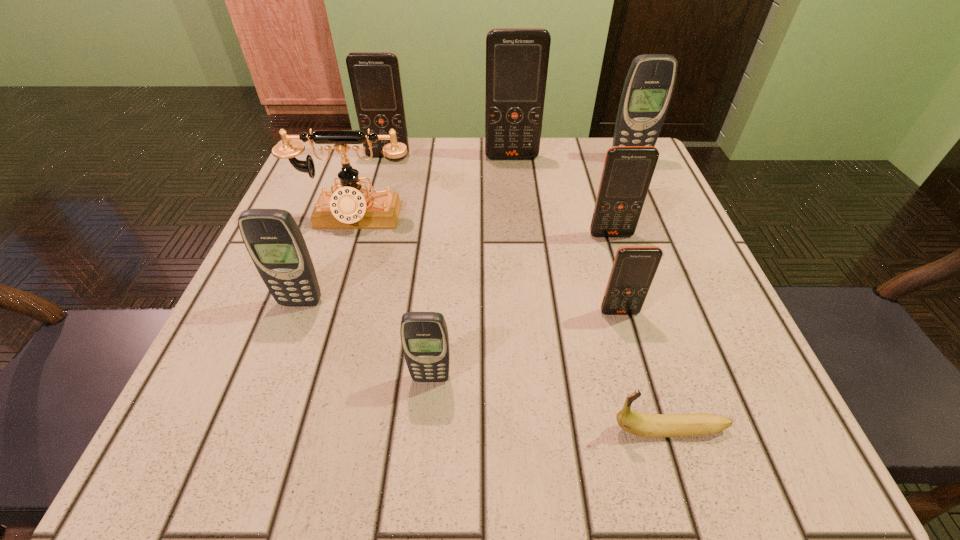
Locate an element on the screen. The height and width of the screenshot is (540, 960). the tallest cellular telephone is located at coordinates (517, 59).

This screenshot has height=540, width=960. Find the location of `the tallest object`. the tallest object is located at coordinates (517, 59).

The height and width of the screenshot is (540, 960). I want to click on the third smallest orange cellular telephone, so click(x=375, y=80).

This screenshot has height=540, width=960. I want to click on the farthest gray cellular telephone, so click(648, 88).

This screenshot has width=960, height=540. In order to click on the biggest gray cellular telephone in this screenshot , I will do `click(648, 88)`.

Locate an element on the screen. The image size is (960, 540). the second smallest gray cellular telephone is located at coordinates (275, 243).

The width and height of the screenshot is (960, 540). Find the location of `the second farthest gray cellular telephone`. the second farthest gray cellular telephone is located at coordinates (275, 243).

What are the coordinates of `the third biggest orange cellular telephone` in the screenshot? It's located at (628, 170).

The image size is (960, 540). Identify the location of the third farthest orange cellular telephone. (628, 170).

Find the location of a particular element. Image resolution: width=960 pixels, height=540 pixels. telephone is located at coordinates (350, 207).